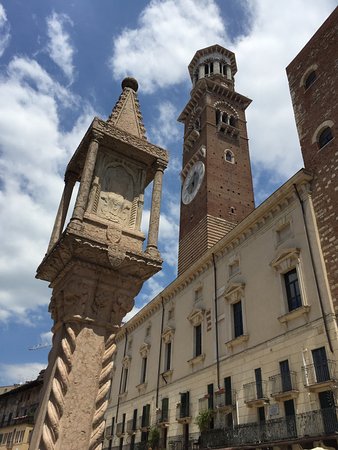
This screenshot has width=338, height=450. Identify the location of door. (286, 364).